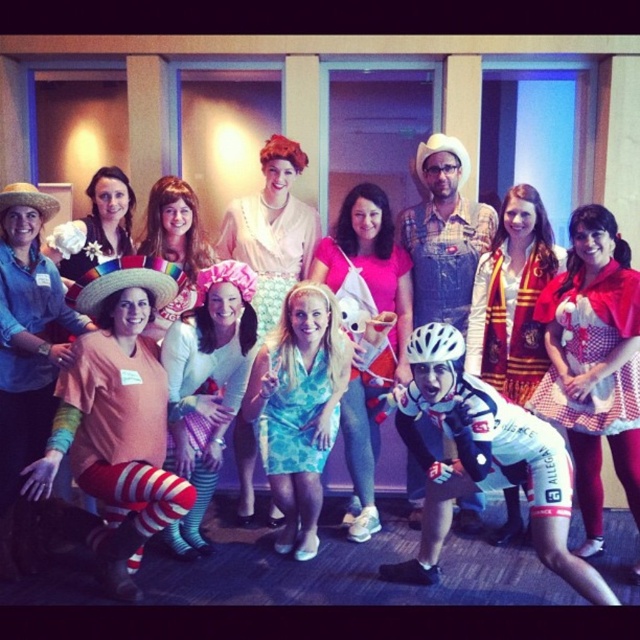
You are a photographer trying to capture a clear shot of the teal floral dress at center without any obstructions. Considering the white matte bicycle helmet at center is in the scene, where is the helmet positioned relative to the dress?

The white matte bicycle helmet at center is behind the teal floral dress at center, so it is positioned behind the dress and may obstruct the view unless adjusted.

Looking at this image, you are a photographer trying to capture a clear shot of both the teal floral dress at center and the white matte bicycle helmet at center. Since you want both subjects to be in focus, you need to adjust your camera settings based on their sizes. Which object should you focus on first to ensure proper depth of field?

The teal floral dress at center is taller than the white matte bicycle helmet at center, so you should focus on the taller teal floral dress at center first to ensure proper depth of field.

Looking at this image, you are at a themed event and see the red scarf at center and the matte peach dress at center. Which item is positioned lower in the image?

The red scarf at center is located below the matte peach dress at center, so it is positioned lower in the image.